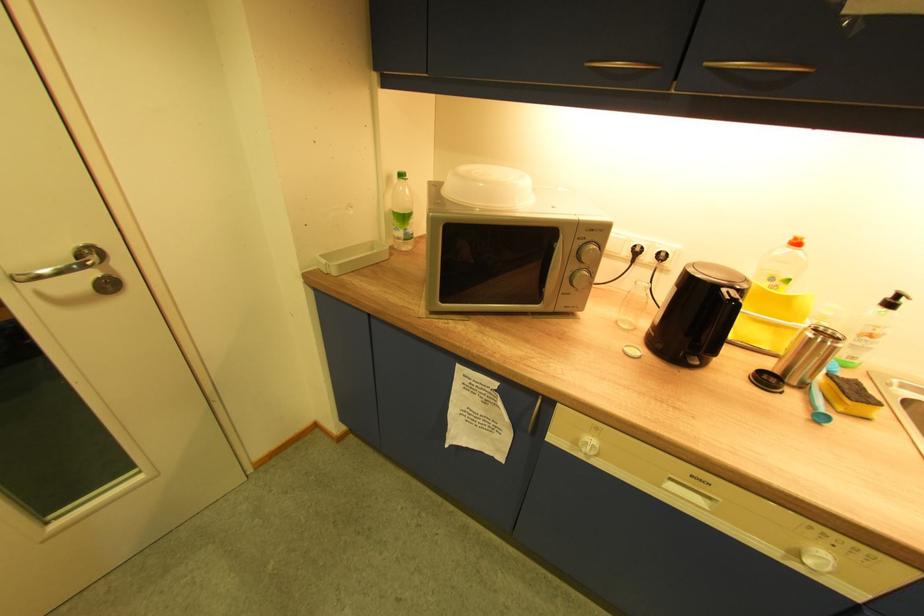
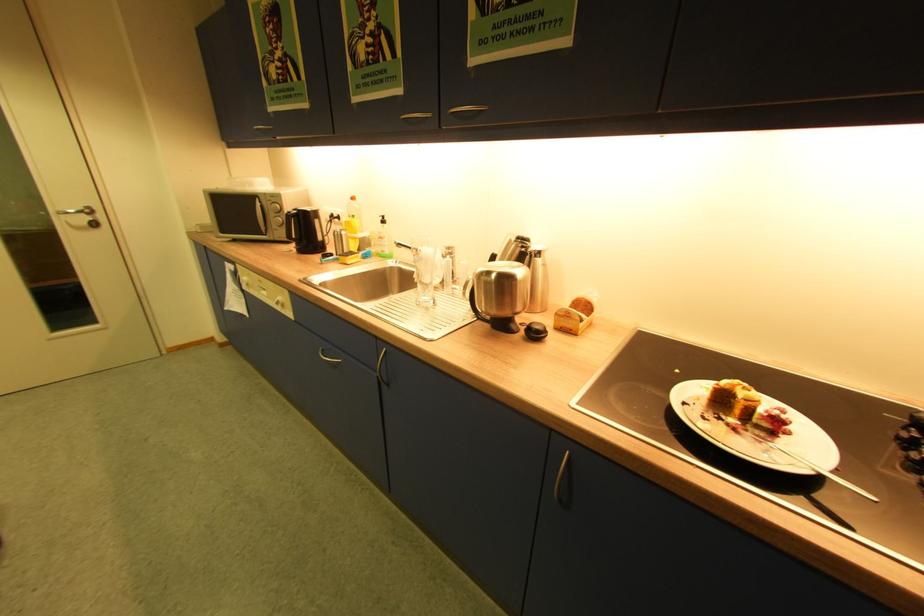
Question: I am providing you with two images of the same scene from different viewpoints. After the viewpoint changes to image2, which objects are now occluded?

Choices:
 (A) yellow plastic bottle
 (B) brown bath mat
 (C) silver door handle
 (D) kettle lid button

Answer: (D)